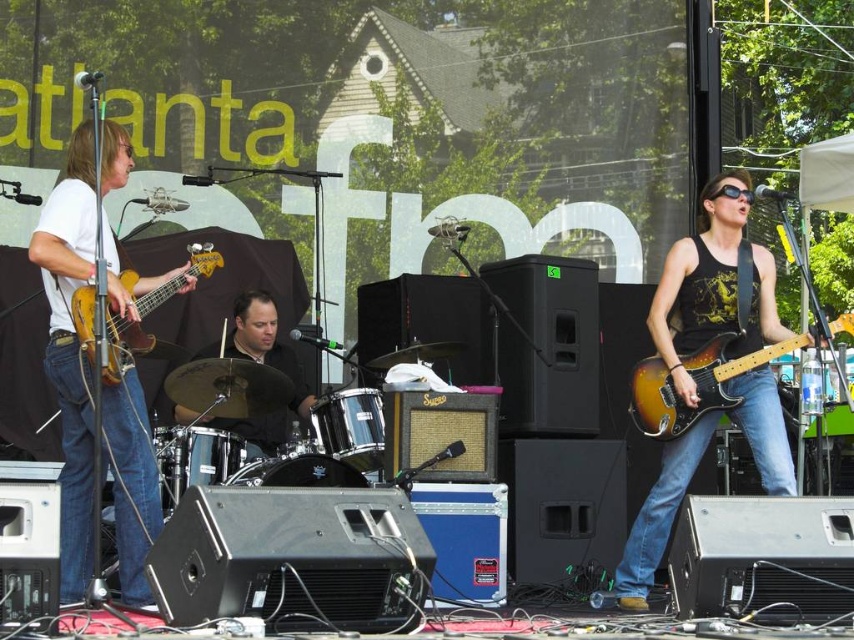
Question: Which object is positioned farthest from the sunburst wood electric guitar at right?

Choices:
 (A) matte brown guitar at left
 (B) satin black guitar at center
 (C) matte yellow bass at left

Answer: (A)

Question: Can you confirm if matte brown guitar at left is positioned below sunburst wood electric guitar at right?

Choices:
 (A) yes
 (B) no

Answer: (B)

Question: Observing the image, what is the correct spatial positioning of satin black guitar at center in reference to sunburst wood electric guitar at right?

Choices:
 (A) right
 (B) left

Answer: (B)

Question: Is satin black guitar at center closer to camera compared to matte yellow bass at left?

Choices:
 (A) no
 (B) yes

Answer: (A)

Question: Which point is farther to the camera?

Choices:
 (A) sunburst wood electric guitar at right
 (B) matte brown guitar at left
 (C) satin black guitar at center
 (D) matte yellow bass at left

Answer: (C)

Question: Based on their relative distances, which object is farther from the satin black guitar at center?

Choices:
 (A) matte yellow bass at left
 (B) sunburst wood electric guitar at right
 (C) black leather drum set at center
 (D) matte brown guitar at left

Answer: (D)